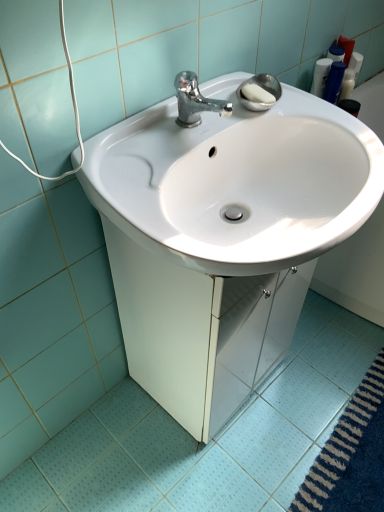
Where is `free space in front of chrome metallic faucet at upper center`? The width and height of the screenshot is (384, 512). free space in front of chrome metallic faucet at upper center is located at coordinates pos(161,154).